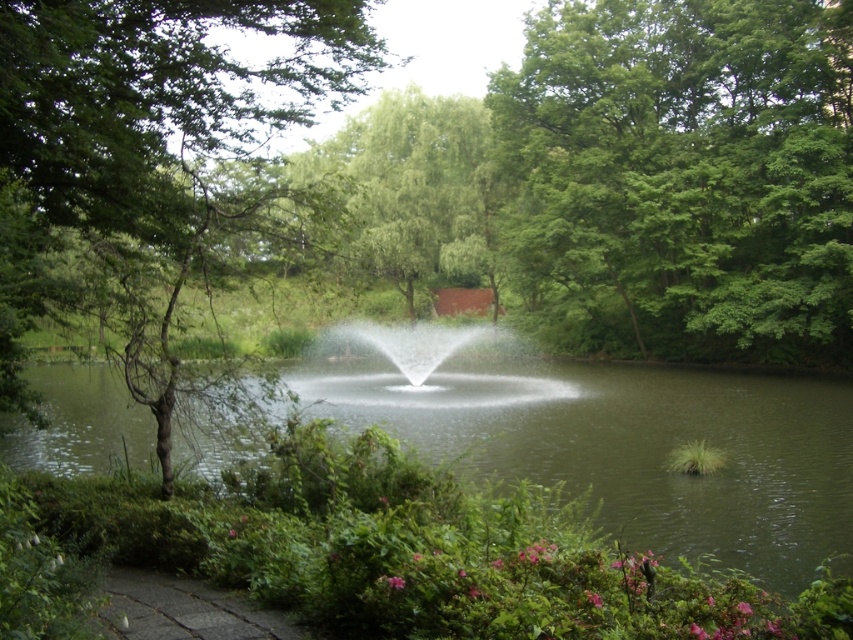
Describe the element at coordinates (685, 176) in the screenshot. I see `green leafy tree at upper center` at that location.

Which is in front, point (679, 109) or point (190, 84)?

Positioned in front is point (190, 84).

The image size is (853, 640). In order to click on green leafy tree at upper center in this screenshot , I will do `click(685, 176)`.

Consider the image. Between clear water at center and green leafy tree at center, which one has less height?

clear water at center is shorter.

Can you confirm if clear water at center is positioned above green leafy tree at center?

Actually, clear water at center is below green leafy tree at center.

I want to click on clear water at center, so click(x=630, y=445).

Who is more forward, (x=804, y=97) or (x=596, y=486)?

Positioned in front is point (x=596, y=486).

Does green leafy tree at upper center have a lesser width compared to clear water at center?

Yes, green leafy tree at upper center is thinner than clear water at center.

Where is `green leafy tree at upper center`? The image size is (853, 640). green leafy tree at upper center is located at coordinates (685, 176).

Where is `green leafy tree at upper center`? This screenshot has height=640, width=853. green leafy tree at upper center is located at coordinates (685, 176).